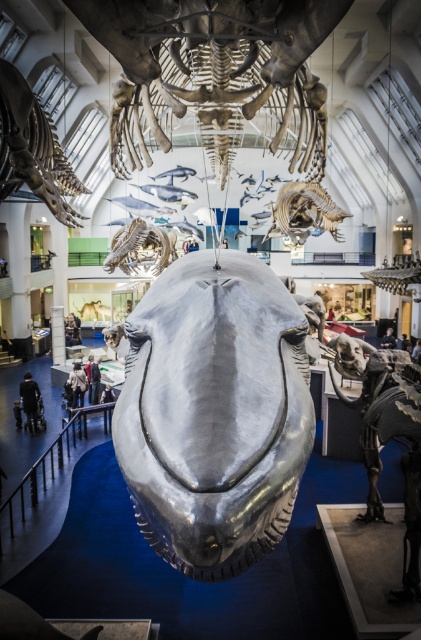
Question: Which of the following is the closest to the observer?

Choices:
 (A) (410, 259)
 (B) (402, 593)
 (C) (236, 566)

Answer: (C)

Question: Which point is closer to the camera?

Choices:
 (A) black fabric at lower left
 (B) shiny metallic dinosaur at upper center
 (C) shiny silver skeleton at upper center
 (D) dark gray fabric jacket at lower center

Answer: (C)

Question: Considering the real-world distances, which object is farthest from the shiny silver dinosaur at upper left?

Choices:
 (A) black fabric at lower left
 (B) shiny metallic dinosaur at upper right
 (C) black leather jacket at lower center

Answer: (B)

Question: Is the position of shiny metallic dinosaur at lower right less distant than that of black fabric at lower left?

Choices:
 (A) no
 (B) yes

Answer: (B)

Question: Observing the image, what is the correct spatial positioning of black fabric at lower left in reference to black leather jacket at lower center?

Choices:
 (A) left
 (B) right

Answer: (A)

Question: From the image, what is the correct spatial relationship of black fabric at lower left in relation to dark blue fabric at lower center?

Choices:
 (A) above
 (B) below

Answer: (B)